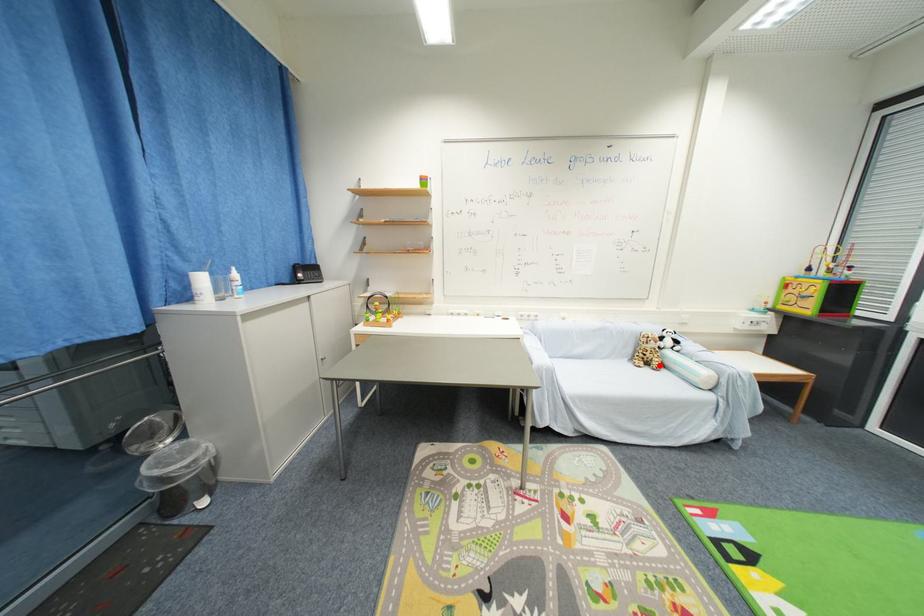
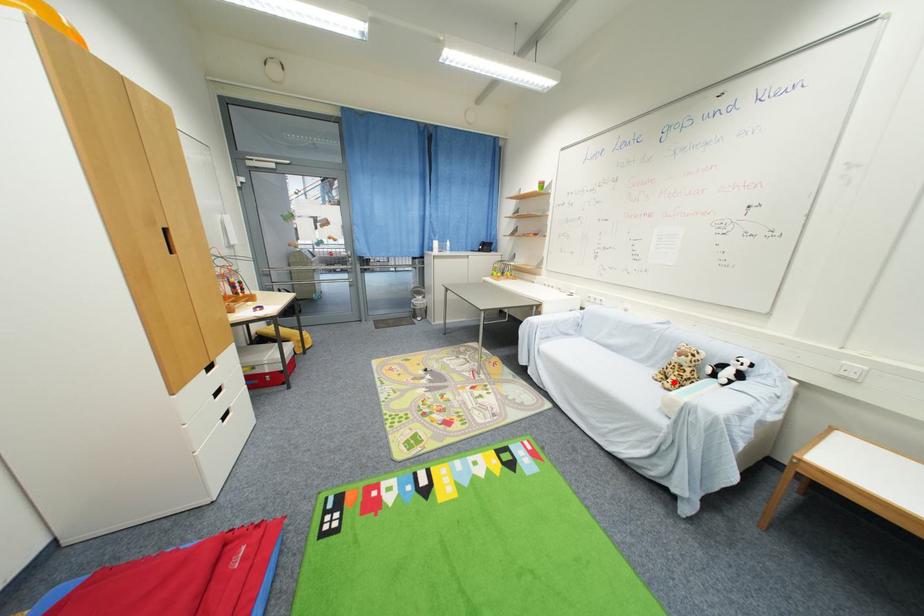
I am providing you with two images of the same scene from different viewpoints. A red point is marked on the first image and another point is marked on the second image. Do the highlighted points in image1 and image2 indicate the same real-world spot?

Yes